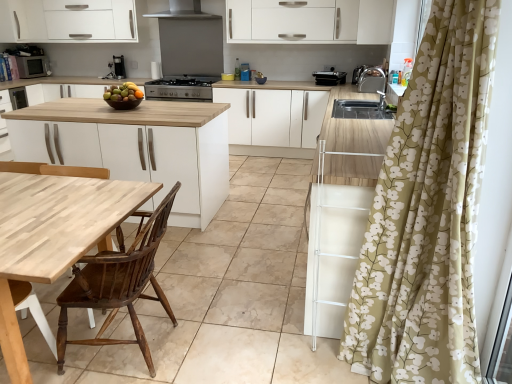
Question: Can we say black matte stove at center lies outside wooden chair at left, acting as the 3th chair starting from the right?

Choices:
 (A) yes
 (B) no

Answer: (A)

Question: Considering the relative positions of black matte stove at center and wooden chair at left, acting as the 3th chair starting from the right, in the image provided, is black matte stove at center to the right of wooden chair at left, acting as the 3th chair starting from the right, from the viewer's perspective?

Choices:
 (A) yes
 (B) no

Answer: (A)

Question: Is black matte stove at center turned away from wooden chair at left, acting as the 3th chair starting from the right?

Choices:
 (A) no
 (B) yes

Answer: (A)

Question: Is black matte stove at center further to camera compared to wooden chair at left, the 1th chair positioned from the left?

Choices:
 (A) no
 (B) yes

Answer: (B)

Question: Is black matte stove at center at the left side of wooden chair at left, the 1th chair positioned from the left?

Choices:
 (A) yes
 (B) no

Answer: (B)

Question: Is black matte stove at center facing towards wooden chair at left, acting as the 3th chair starting from the right?

Choices:
 (A) yes
 (B) no

Answer: (A)

Question: From a real-world perspective, is satin nickel faucet at upper right, the 3th appliance viewed from the left, physically above black matte stove at center?

Choices:
 (A) yes
 (B) no

Answer: (A)

Question: From the image's perspective, is satin nickel faucet at upper right, the 1th appliance positioned from the front, above black matte stove at center?

Choices:
 (A) no
 (B) yes

Answer: (A)

Question: Can you confirm if satin nickel faucet at upper right, the 1th appliance ordered from the bottom, is positioned to the right of black matte stove at center?

Choices:
 (A) yes
 (B) no

Answer: (A)

Question: Is satin nickel faucet at upper right, the first appliance viewed from the right, positioned before black matte stove at center?

Choices:
 (A) yes
 (B) no

Answer: (A)

Question: Is satin nickel faucet at upper right, the first appliance viewed from the right, positioned far away from black matte stove at center?

Choices:
 (A) yes
 (B) no

Answer: (A)

Question: Does satin nickel faucet at upper right, the 1th appliance positioned from the front, have a greater width compared to black matte stove at center?

Choices:
 (A) no
 (B) yes

Answer: (A)

Question: Is white matte cabinet at upper left, which is the 1th cabinetry from left to right, shorter than white matte cabinet at center, the 1th cabinetry when ordered from bottom to top?

Choices:
 (A) yes
 (B) no

Answer: (A)